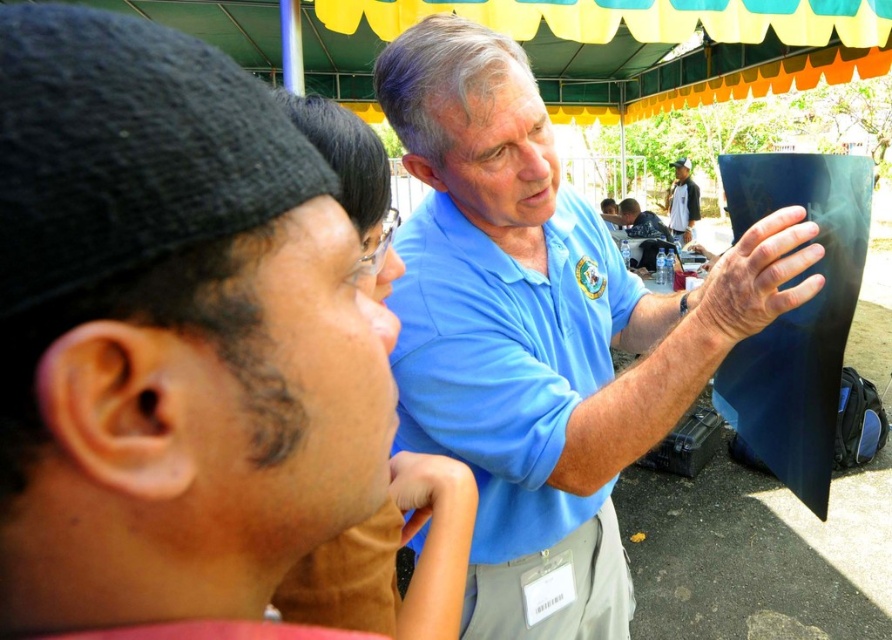
You are a delivery robot that is 1.5 meters tall. You need to deliver a package to the person wearing the blue matte shirt at upper center. However, there is another person wearing the matte blue shirt at center in your path. Can you safely pass between them without hitting either person?

The distance between blue matte shirt at upper center and matte blue shirt at center is 6.66 meters, so yes, the robot can safely pass between them since the distance is greater than the robot height of 1.5 meters.

You are a photographer trying to capture a candid shot of both the blue cotton polo shirt at center and the white cotton shirt at upper center. Since you want to ensure both subjects are in the frame, which direction should you move your camera to include both?

The blue cotton polo shirt at center is positioned on the left side of white cotton shirt at upper center. To include both in the frame, you should move the camera to the left to capture the blue cotton polo shirt at center and to the right to capture the white cotton shirt at upper center, ensuring both are centered in the shot.

From the picture: You are a healthcare professional attending a meeting. You see the blue matte shirt at center and the white cotton shirt at upper center. Which one is positioned to the left?

The blue matte shirt at center is positioned to the left of the white cotton shirt at upper center.